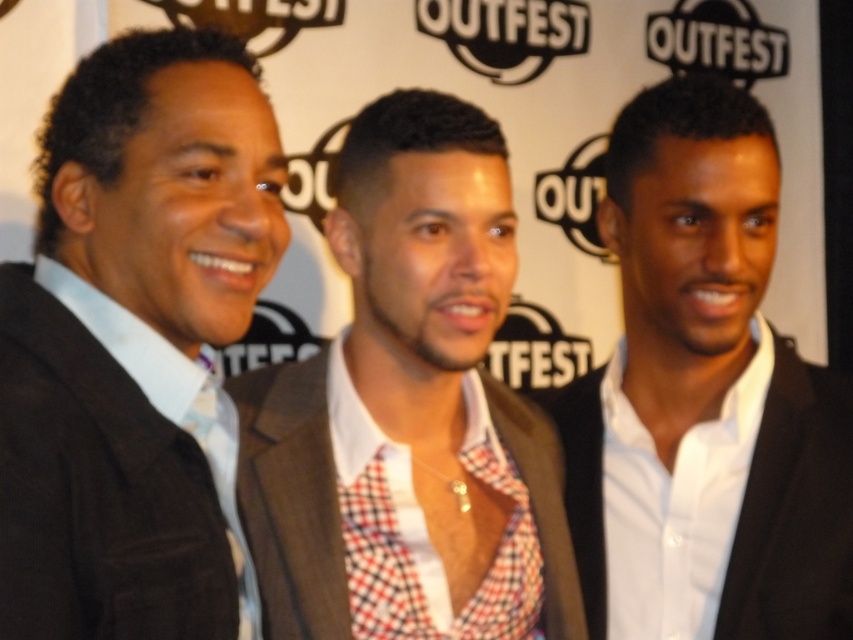
Is matte black suit at left to the left of white glossy suit at center from the viewer's perspective?

Correct, you'll find matte black suit at left to the left of white glossy suit at center.

Does point (50, 598) come closer to viewer compared to point (793, 420)?

Yes, point (50, 598) is closer to viewer.

The height and width of the screenshot is (640, 853). In order to click on matte black suit at left in this screenshot , I will do `click(132, 339)`.

Does matte black suit at left appear on the left side of checkered fabric shirt at center?

Yes, matte black suit at left is to the left of checkered fabric shirt at center.

Is matte black suit at left to the right of checkered fabric shirt at center from the viewer's perspective?

In fact, matte black suit at left is to the left of checkered fabric shirt at center.

What do you see at coordinates (132, 339) in the screenshot?
I see `matte black suit at left` at bounding box center [132, 339].

Image resolution: width=853 pixels, height=640 pixels. What are the coordinates of `matte black suit at left` in the screenshot? It's located at (132, 339).

Which is above, checkered fabric shirt at center or white glossy suit at center?

checkered fabric shirt at center

Is checkered fabric shirt at center positioned behind white glossy suit at center?

No, checkered fabric shirt at center is closer to the viewer.

Identify the location of checkered fabric shirt at center. The width and height of the screenshot is (853, 640). (408, 408).

You are a GUI agent. You are given a task and a screenshot of the screen. Output one action in this format:
    pyautogui.click(x=<x>, y=<y>)
    Task: Click on the checkered fabric shirt at center
    This screenshot has width=853, height=640.
    Given the screenshot: What is the action you would take?
    pyautogui.click(x=408, y=408)